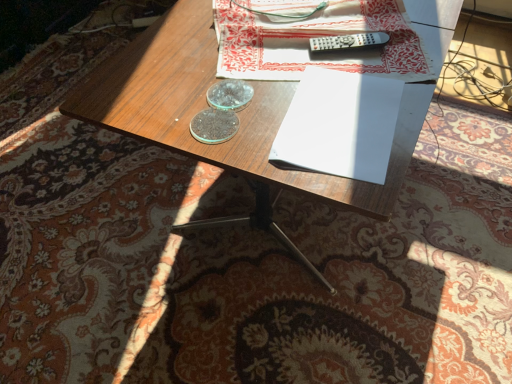
At what (x,y) coordinates should I click in order to perform the action: click on vacant space behind white paper at center. Please return your answer as a coordinate pair (x, y). This screenshot has width=512, height=384. Looking at the image, I should click on (x=324, y=50).